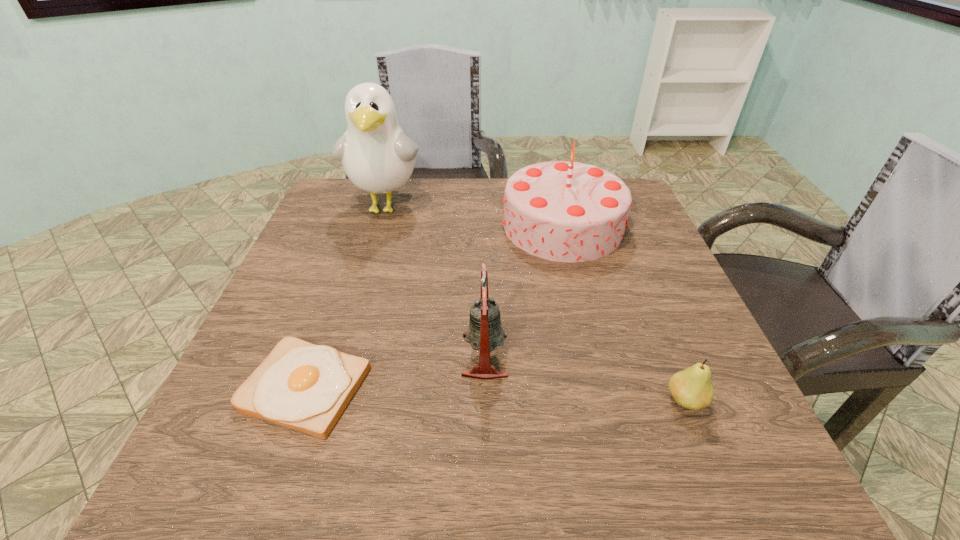
Image resolution: width=960 pixels, height=540 pixels. Identify the location of free spot located on the back of the shortest object. (364, 222).

The width and height of the screenshot is (960, 540). I want to click on gull located in the far edge section of the desktop, so [377, 156].

Locate an element on the screen. birthday cake that is positioned at the far edge is located at coordinates (566, 211).

Find the location of a particular element. object at the near edge is located at coordinates (302, 386).

This screenshot has width=960, height=540. I want to click on gull present at the left edge, so (x=377, y=156).

Where is `toast that is at the left edge`? toast that is at the left edge is located at coordinates pyautogui.click(x=302, y=386).

This screenshot has width=960, height=540. In order to click on birthday cake that is at the right edge in this screenshot , I will do `click(566, 211)`.

I want to click on pear at the right edge, so click(x=691, y=388).

Locate an element on the screen. Image resolution: width=960 pixels, height=540 pixels. object present at the far left corner is located at coordinates (x=377, y=156).

Image resolution: width=960 pixels, height=540 pixels. I want to click on object positioned at the near left corner, so 302,386.